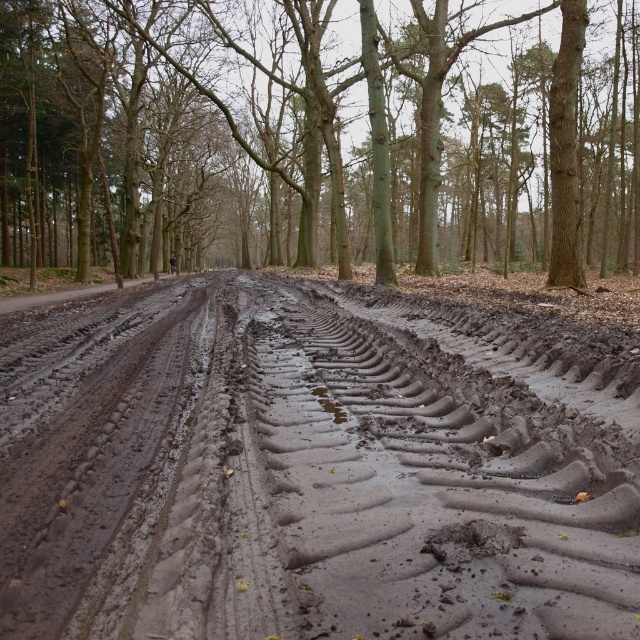
You are a hiker with a 50 meter long rope. You spot the muddy rubber tire tracks at center and the brown smooth tree at center in the forest. Can you tie the rope between them without it touching the ground?

The muddy rubber tire tracks at center and brown smooth tree at center are 50.86 meters apart from each other. Since the rope is only 50 meters long, it will not reach between them without sagging, so the rope will touch the ground.

You are a hiker trying to navigate through the muddy forest road. You see the muddy rubber tire tracks at center and the brown smooth tree at center. Which one is narrower in width?

The muddy rubber tire tracks at center is thinner than brown smooth tree at center, so the muddy rubber tire tracks at center is narrower in width.